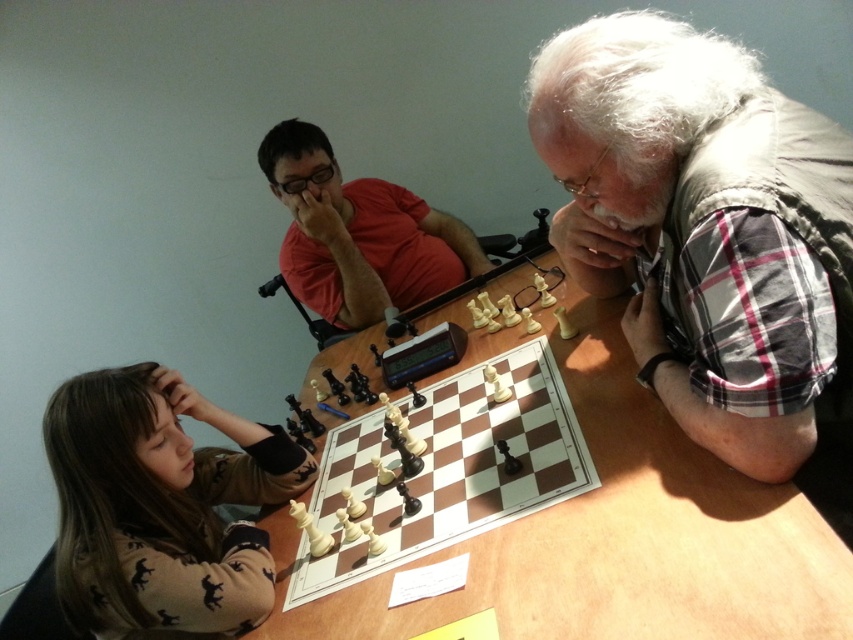
Question: Is gray vest at upper right smaller than wooden table at center?

Choices:
 (A) yes
 (B) no

Answer: (A)

Question: Which object appears closest to the camera in this image?

Choices:
 (A) brown sweater at lower left
 (B) wooden chessboard at center
 (C) wooden table at center
 (D) gray vest at upper right

Answer: (C)

Question: Can you confirm if gray vest at upper right is smaller than wooden chessboard at center?

Choices:
 (A) no
 (B) yes

Answer: (A)

Question: Can you confirm if brown sweater at lower left is wider than red matte shirt at center?

Choices:
 (A) no
 (B) yes

Answer: (A)

Question: Which object is farther from the camera taking this photo?

Choices:
 (A) red matte shirt at center
 (B) gray vest at upper right

Answer: (A)

Question: Based on their relative distances, which object is farther from the red matte shirt at center?

Choices:
 (A) wooden table at center
 (B) gray vest at upper right
 (C) brown sweater at lower left
 (D) wooden chessboard at center

Answer: (B)